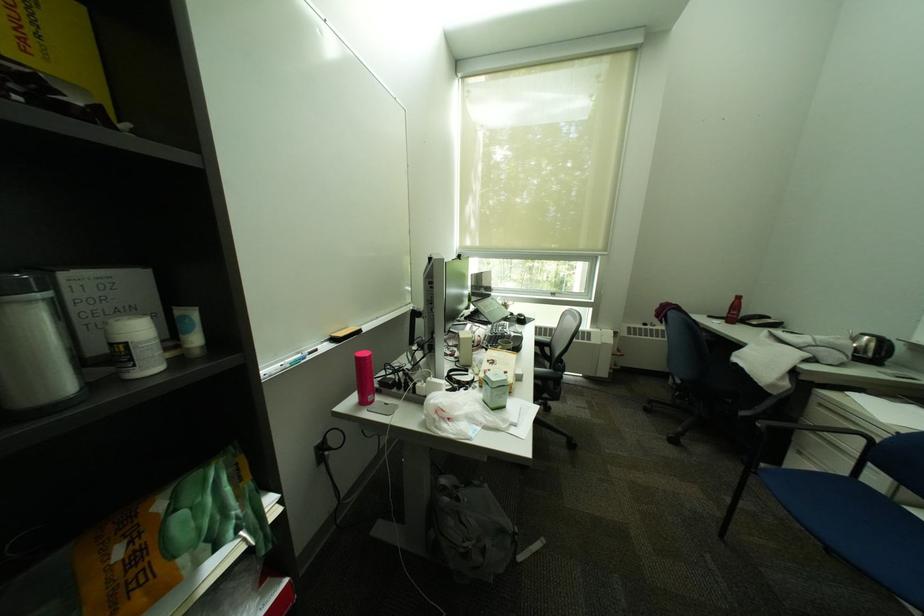
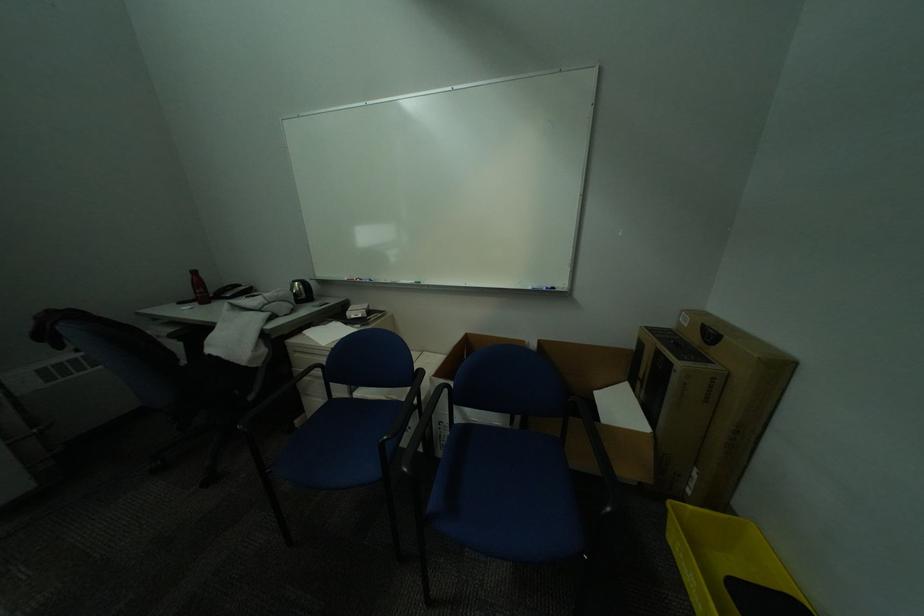
The point at (867, 352) is marked in the first image. Where is the corresponding point in the second image?

(307, 296)